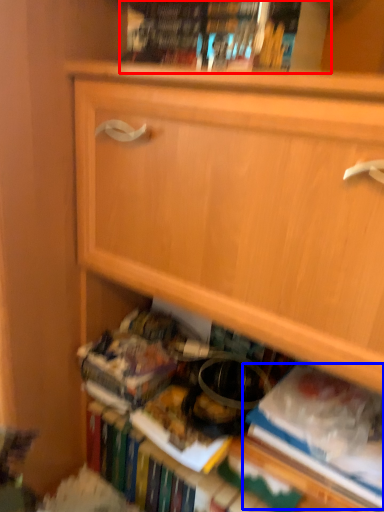
Question: Which of the following is the closest to the observer, book (highlighted by a red box) or paperback book (highlighted by a blue box)?

Choices:
 (A) book
 (B) paperback book

Answer: (A)